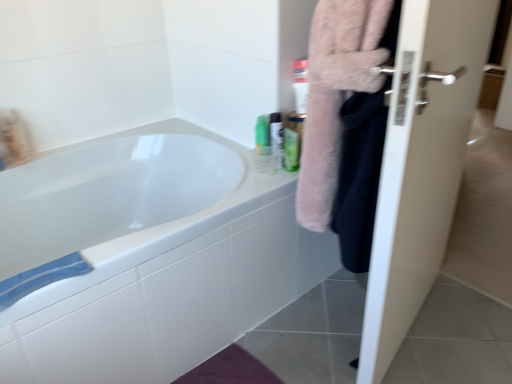
Locate an element on the screen. The height and width of the screenshot is (384, 512). vacant space that's between blue cotton towel at lower left, which is the 1th bath towel in bottom-to-top order, and green matte bottle at upper right, placed as the fourth mouthwash when sorted from left to right is located at coordinates (203, 209).